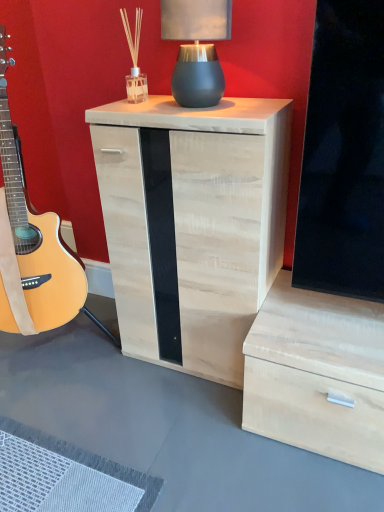
The width and height of the screenshot is (384, 512). I want to click on vacant region in front of natural wood guitar at left, so 64,418.